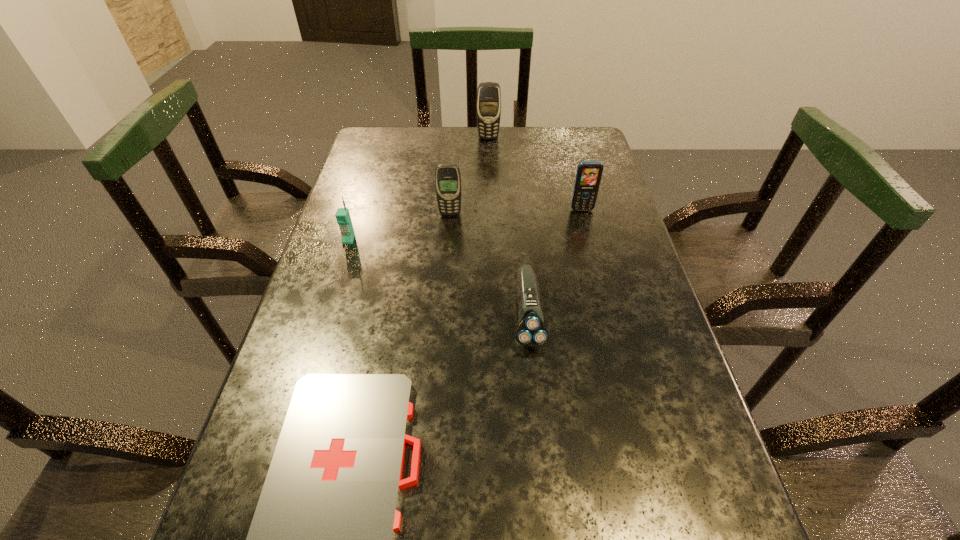
This screenshot has width=960, height=540. Identify the location of the third cellular telephone from left to right. (489, 94).

Image resolution: width=960 pixels, height=540 pixels. I want to click on the farthest object, so click(x=489, y=94).

The image size is (960, 540). Find the location of `the third farthest object`. the third farthest object is located at coordinates (447, 177).

This screenshot has height=540, width=960. In order to click on the second cellular telephone from left to right in this screenshot , I will do `click(447, 177)`.

In order to click on the rightmost object in this screenshot , I will do `click(589, 173)`.

Where is `the rightmost cellular telephone`? This screenshot has width=960, height=540. the rightmost cellular telephone is located at coordinates (589, 173).

Locate an element on the screen. The width and height of the screenshot is (960, 540). the leftmost cellular telephone is located at coordinates (343, 218).

At what (x,y) coordinates should I click in order to perform the action: click on the nearest cellular telephone. Please return your answer as a coordinate pair (x, y). Looking at the image, I should click on (343, 218).

Identify the location of electric shaver. (531, 332).

The image size is (960, 540). What are the coordinates of `the second shortest object` in the screenshot? It's located at pos(531,332).